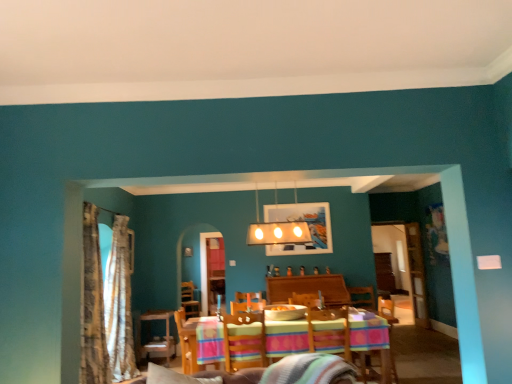
Question: Considering their positions, is wooden table at center located in front of or behind white glossy light fixture at upper center?

Choices:
 (A) behind
 (B) front

Answer: (A)

Question: Is wooden table at center taller or shorter than white glossy light fixture at upper center?

Choices:
 (A) short
 (B) tall

Answer: (A)

Question: Considering the real-world distances, which object is farthest from the multicolored fabric armchair at center, the second armchair positioned from the right?

Choices:
 (A) multicolored fabric armchair at lower right, which is counted as the 1th armchair, starting from the right
 (B) metallic silver picture frame at center
 (C) wooden table with striped tablecloth at center
 (D) white glossy light fixture at upper center
 (E) gold textured curtain at left, positioned as the second curtain in front-to-back order

Answer: (A)

Question: Estimate the real-world distances between objects in this image. Which object is farther from the multicolored fabric armchair at center, the second armchair positioned from the right?

Choices:
 (A) white glossy light fixture at upper center
 (B) transparent glass door at center
 (C) striped woolen blanket at center
 (D) multicolored fabric armchair at lower right, which is counted as the 1th armchair, starting from the right
 (E) wooden table at center

Answer: (B)